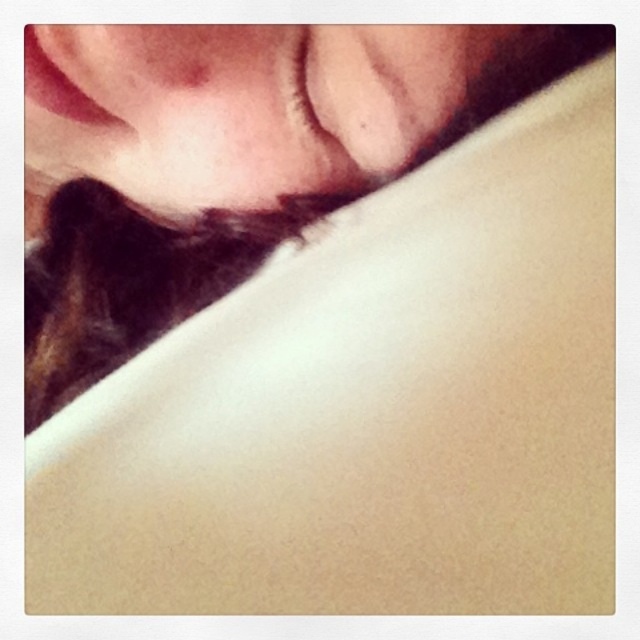
Can you confirm if smooth skin at center is wider than matte skin at upper center?

No.

Is smooth skin at center shorter than matte skin at upper center?

Result: Yes.

Locate an element on the screen. The width and height of the screenshot is (640, 640). smooth skin at center is located at coordinates (236, 106).